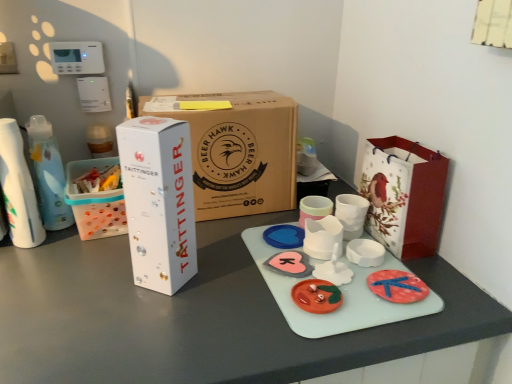
Identify the location of vacant point to the right of white glossy cup at center, the second toy positioned from the front. (420, 278).